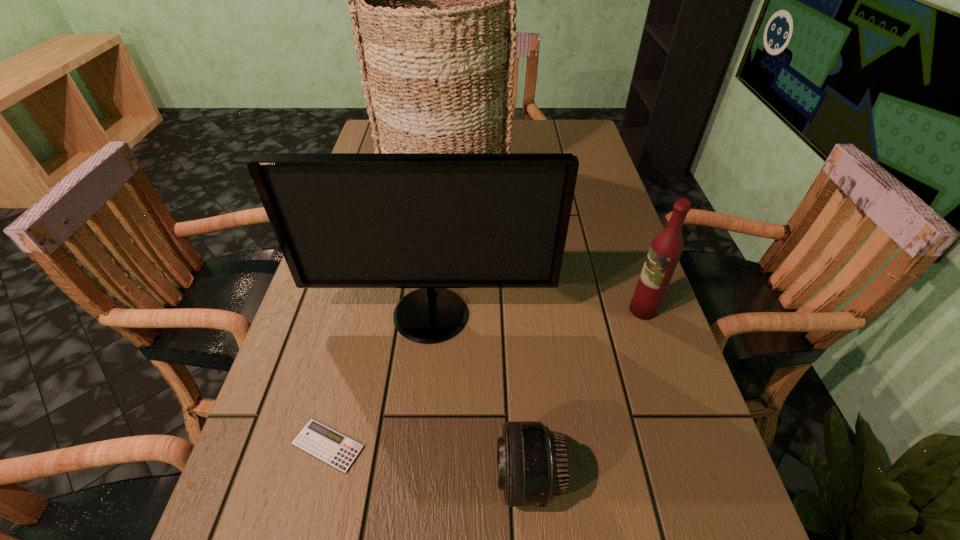
The width and height of the screenshot is (960, 540). I want to click on free spot between the basket and the calculator, so click(x=387, y=309).

The image size is (960, 540). Find the location of `free space between the fourth shortest object and the shortest object`. free space between the fourth shortest object and the shortest object is located at coordinates (379, 380).

The width and height of the screenshot is (960, 540). I want to click on free space between the liquor and the calculator, so click(486, 377).

This screenshot has width=960, height=540. Find the location of `object identified as the third closest to the rightmost object`. object identified as the third closest to the rightmost object is located at coordinates (433, 0).

Select which object is the fourth closest to the second tallest object. Please provide its 2D coordinates. Your answer should be formatted as a tuple, i.e. [(x, y)], where the tuple contains the x and y coordinates of a point satisfying the conditions above.

[(433, 0)]

Find the location of `free spot that satisfies the following two spatial constraints: 1. on the label of the rightmost object; 2. on the front-facing side of the fourth shortest object`. free spot that satisfies the following two spatial constraints: 1. on the label of the rightmost object; 2. on the front-facing side of the fourth shortest object is located at coordinates (645, 315).

Where is `blank area in the image that satisfies the following two spatial constraints: 1. on the back side of the tallest object; 2. on the right side of the calculator`? The width and height of the screenshot is (960, 540). blank area in the image that satisfies the following two spatial constraints: 1. on the back side of the tallest object; 2. on the right side of the calculator is located at coordinates (396, 174).